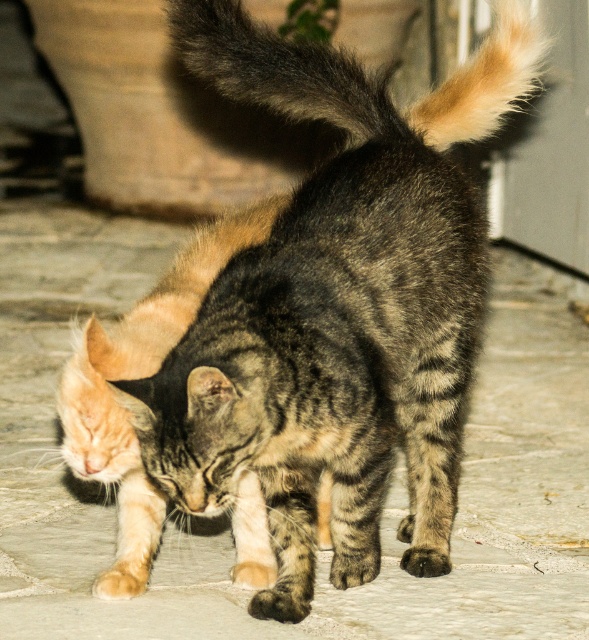
Question: Is light brown fur paw at lower left in front of brown fur paw at lower center?

Choices:
 (A) no
 (B) yes

Answer: (B)

Question: Which of the following is the farthest from the observer?

Choices:
 (A) (71, 410)
 (B) (495, 8)

Answer: (B)

Question: Is fuzzy fur tail at upper center positioned before light brown fur paw at lower left?

Choices:
 (A) no
 (B) yes

Answer: (B)

Question: Which of the following is the farthest from the observer?

Choices:
 (A) dark brown fur paw at lower center
 (B) fuzzy fur tail at upper center
 (C) brown fur paw at lower center

Answer: (C)

Question: Which of the following is the farthest from the observer?

Choices:
 (A) (448, 115)
 (B) (415, 560)
 (C) (236, 576)
 (D) (299, 602)

Answer: (A)

Question: Is tabby fur cat at center positioned before brown fur paw at lower center?

Choices:
 (A) yes
 (B) no

Answer: (A)